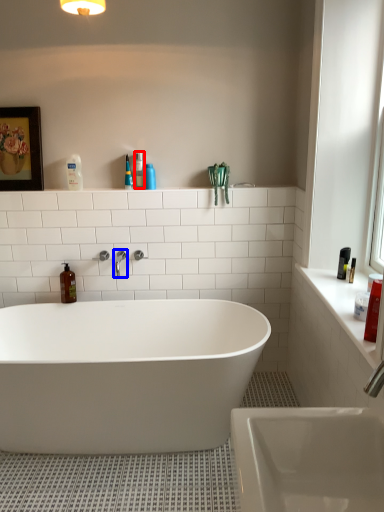
Question: Which point is closer to the camera, toiletry (highlighted by a red box) or tap (highlighted by a blue box)?

Choices:
 (A) toiletry
 (B) tap

Answer: (B)